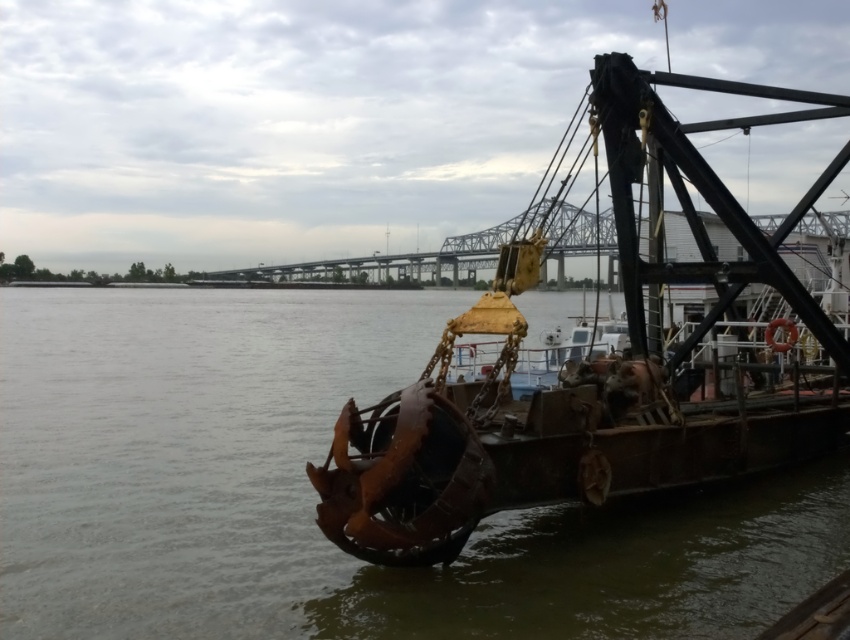
Question: Does rusty metal river at center appear under rusty metal barge at center?

Choices:
 (A) no
 (B) yes

Answer: (B)

Question: Which point appears closest to the camera in this image?

Choices:
 (A) (386, 317)
 (B) (394, 545)

Answer: (B)

Question: Which point is farther from the camera taking this photo?

Choices:
 (A) (400, 298)
 (B) (420, 515)

Answer: (A)

Question: Is the position of rusty metal river at center less distant than that of rusty metal barge at center?

Choices:
 (A) yes
 (B) no

Answer: (B)

Question: Does rusty metal river at center have a smaller size compared to rusty metal barge at center?

Choices:
 (A) yes
 (B) no

Answer: (A)